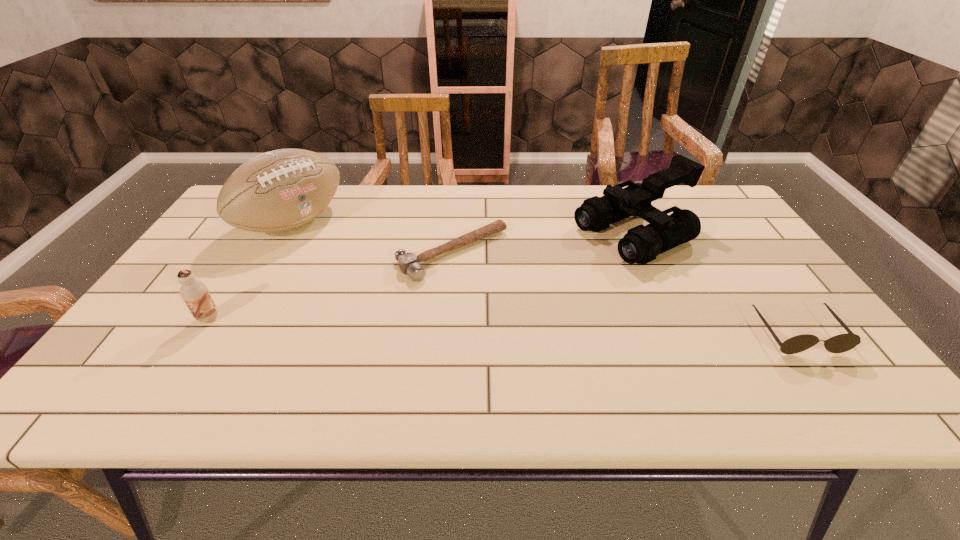
Locate an element on the screen. The width and height of the screenshot is (960, 540). vacant space located 0.290m on the laces of the football (American) is located at coordinates (387, 285).

Locate an element on the screen. This screenshot has height=540, width=960. free space located 0.260m on the laces of the football (American) is located at coordinates tap(379, 280).

Where is `vacant space located 0.100m on the striking face of the hammer`? The image size is (960, 540). vacant space located 0.100m on the striking face of the hammer is located at coordinates (509, 300).

Identify the location of free location located on the striking face of the hammer. The height and width of the screenshot is (540, 960). (530, 319).

Identify the location of free spot located on the striking face of the hammer. The height and width of the screenshot is (540, 960). (509, 300).

Locate an element on the screen. The width and height of the screenshot is (960, 540). vacant space located on the front lenses of the second object from right to left is located at coordinates (531, 278).

Image resolution: width=960 pixels, height=540 pixels. In order to click on free space located on the front lenses of the second object from right to left in this screenshot , I will do `click(531, 278)`.

Find the location of `vacant region located 0.220m on the front lenses of the second object from right to left`. vacant region located 0.220m on the front lenses of the second object from right to left is located at coordinates (525, 280).

Find the location of `football (American) present at the far edge`. football (American) present at the far edge is located at coordinates (280, 190).

Locate an element on the screen. This screenshot has width=960, height=540. binoculars that is positioned at the far edge is located at coordinates (641, 244).